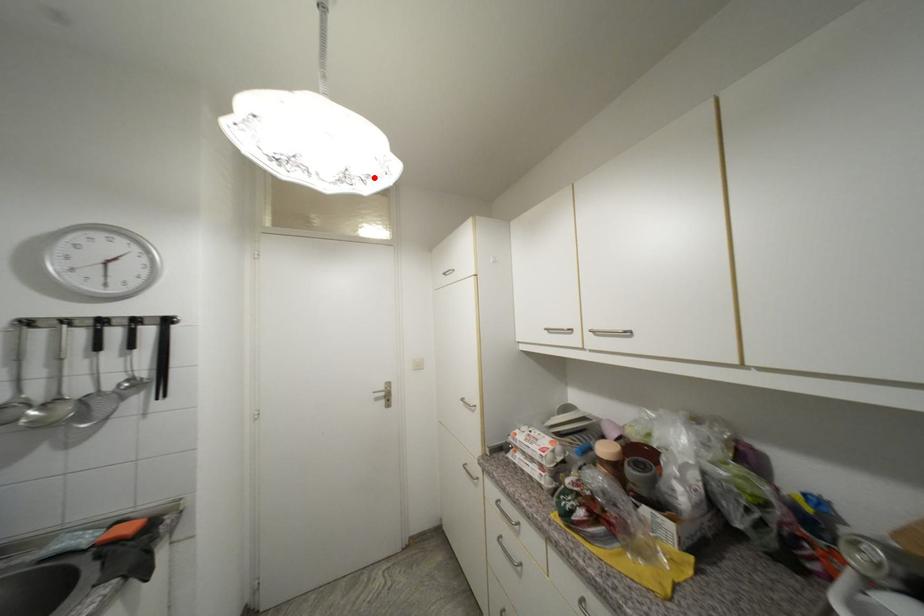
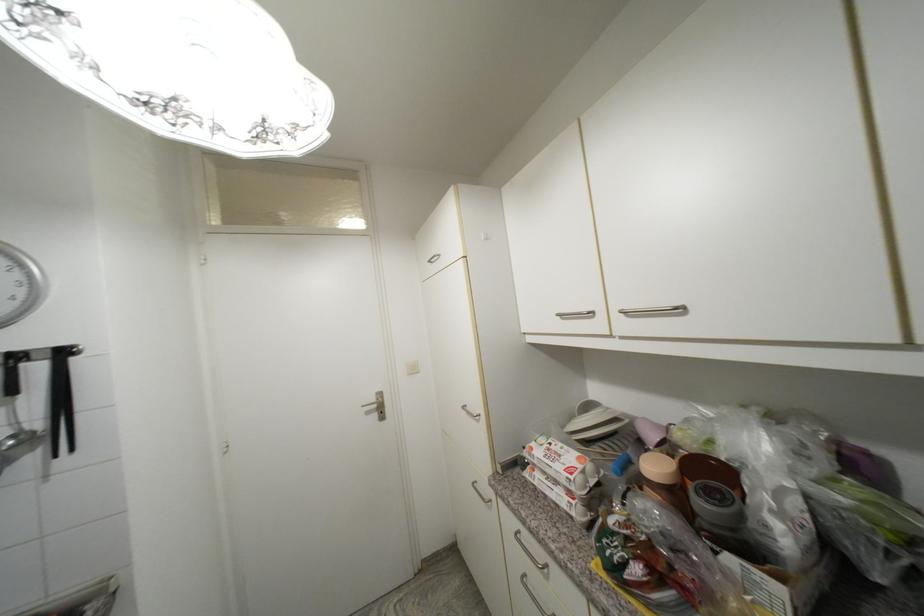
Where in the second image is the point corresponding to the highlighted location from the first image?

(301, 128)